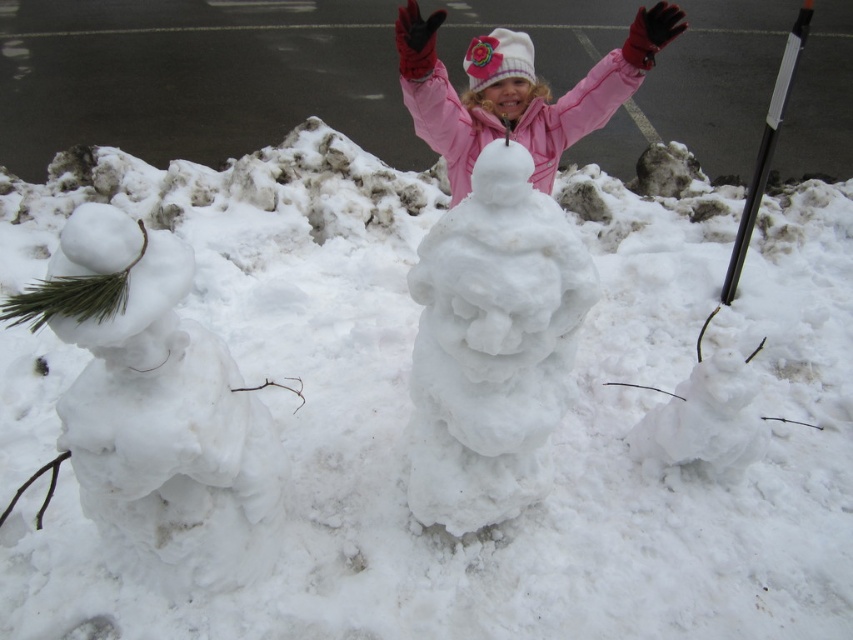
Question: Which point is closer to the camera?

Choices:
 (A) (102, 280)
 (B) (421, 458)

Answer: (A)

Question: Which point is farther to the camera?

Choices:
 (A) (454, 125)
 (B) (149, 237)
 (C) (556, 355)

Answer: (A)

Question: Can you confirm if white fluffy snowman at center is positioned above pink fleece jacket at center?

Choices:
 (A) yes
 (B) no

Answer: (B)

Question: Is white fluffy snowman at left below white fluffy snowman at center?

Choices:
 (A) yes
 (B) no

Answer: (A)

Question: Is white fluffy snowman at center to the left of pink fleece jacket at center from the viewer's perspective?

Choices:
 (A) yes
 (B) no

Answer: (A)

Question: Which point appears closest to the camera in this image?

Choices:
 (A) (566, 307)
 (B) (76, 264)

Answer: (B)